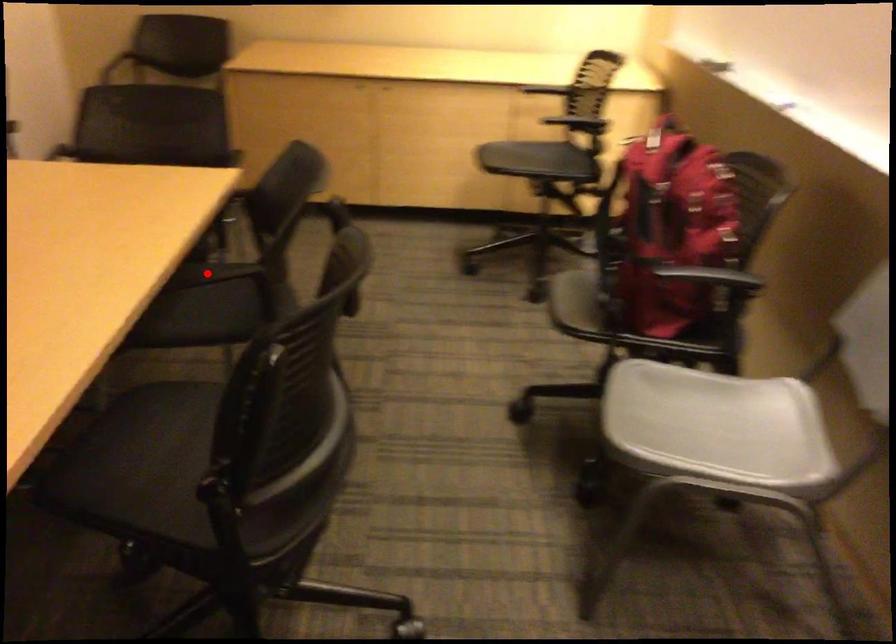
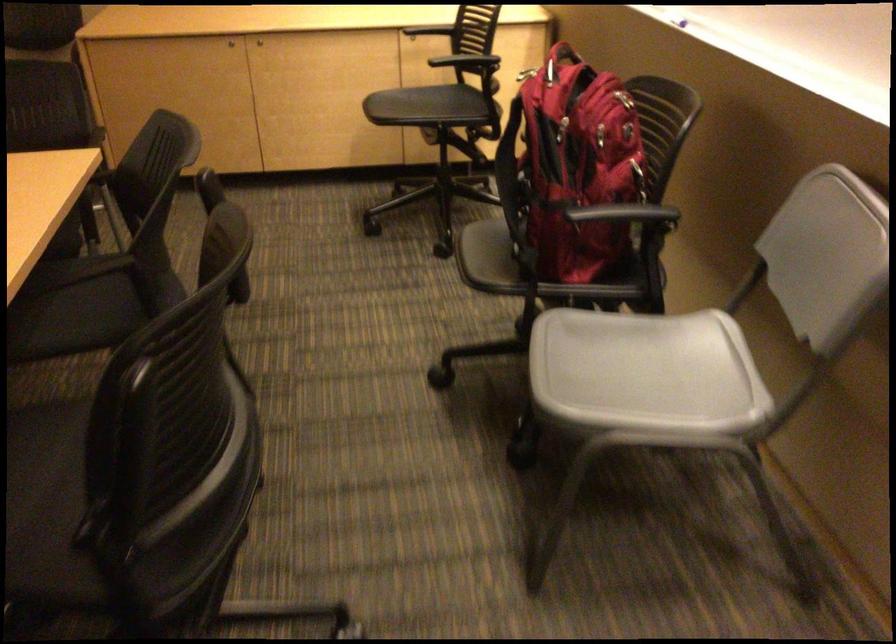
The point at the highlighted location is marked in the first image. Where is the corresponding point in the second image?

(74, 270)